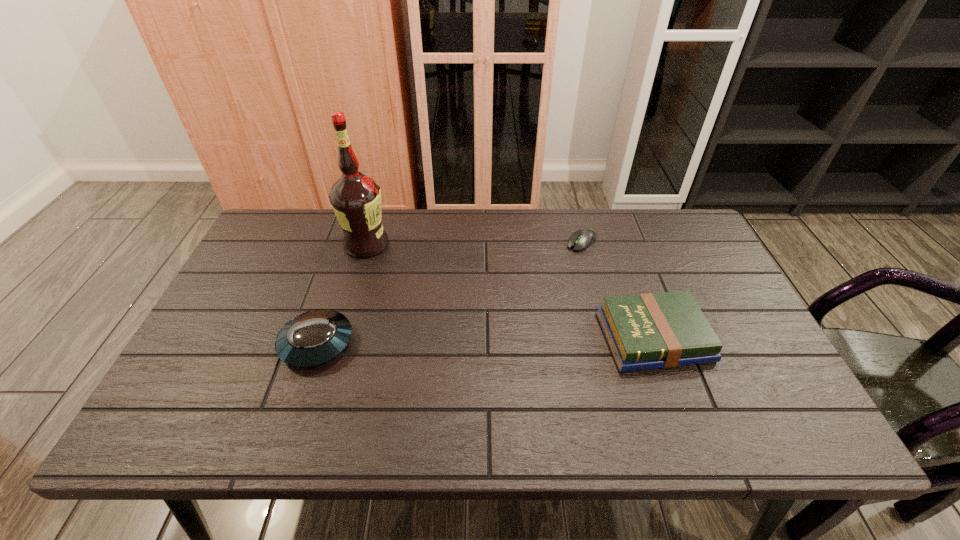
Image resolution: width=960 pixels, height=540 pixels. What are the coordinates of `free spot at the left edge of the desktop` in the screenshot? It's located at (242, 357).

Find the location of a particular element. This screenshot has height=540, width=960. free region at the near right corner of the desktop is located at coordinates (795, 400).

This screenshot has width=960, height=540. Identify the location of free spot between the shortest object and the tallest object. click(474, 243).

This screenshot has height=540, width=960. What are the coordinates of `empty space that is in between the computer mouse and the book` in the screenshot? It's located at 617,289.

This screenshot has width=960, height=540. Find the location of `free space between the saucer and the shortest object`. free space between the saucer and the shortest object is located at coordinates (449, 292).

Locate an element on the screen. This screenshot has width=960, height=540. vacant space that's between the saucer and the tallest object is located at coordinates (342, 294).

Where is `vacant space in between the shortest object and the alcohol`? The width and height of the screenshot is (960, 540). vacant space in between the shortest object and the alcohol is located at coordinates (474, 243).

This screenshot has width=960, height=540. I want to click on vacant region between the book and the computer mouse, so click(x=617, y=289).

At what (x,y) coordinates should I click in order to perform the action: click on vacant point located between the book and the alcohol. Please return your answer as a coordinate pair (x, y). Looking at the image, I should click on (510, 291).

Identify the location of free space between the shortest object and the alcohol. (474, 243).